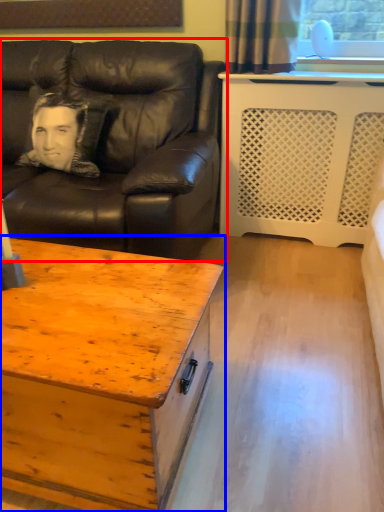
Question: Which of the following is the farthest to the observer, studio couch (highlighted by a red box) or coffee table (highlighted by a blue box)?

Choices:
 (A) studio couch
 (B) coffee table

Answer: (A)